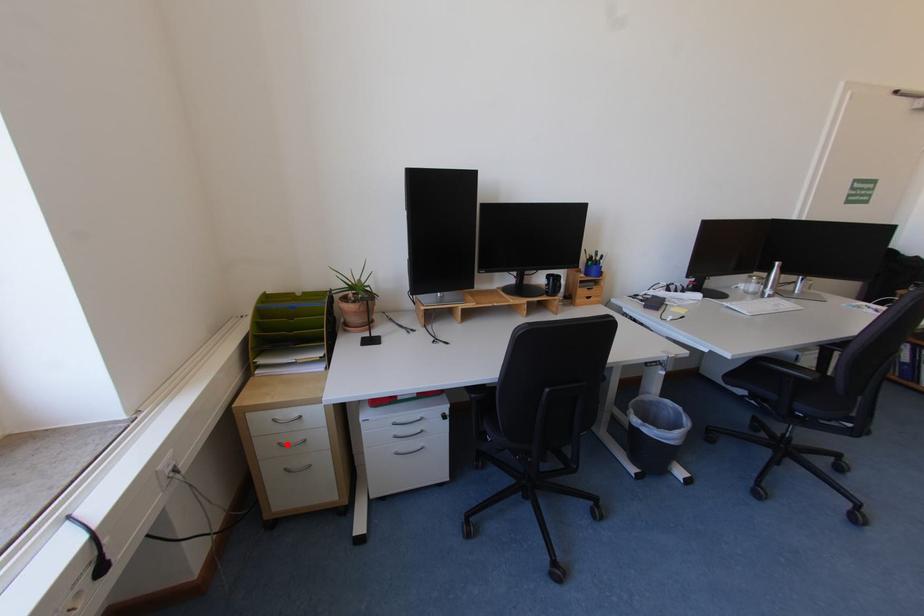
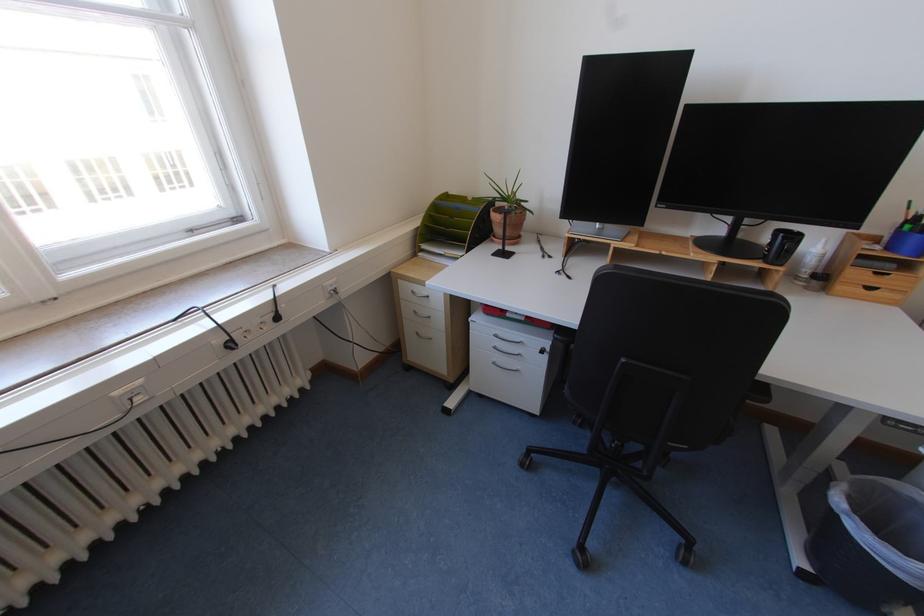
The point at the highlighted location is marked in the first image. Where is the corresponding point in the second image?

(422, 312)